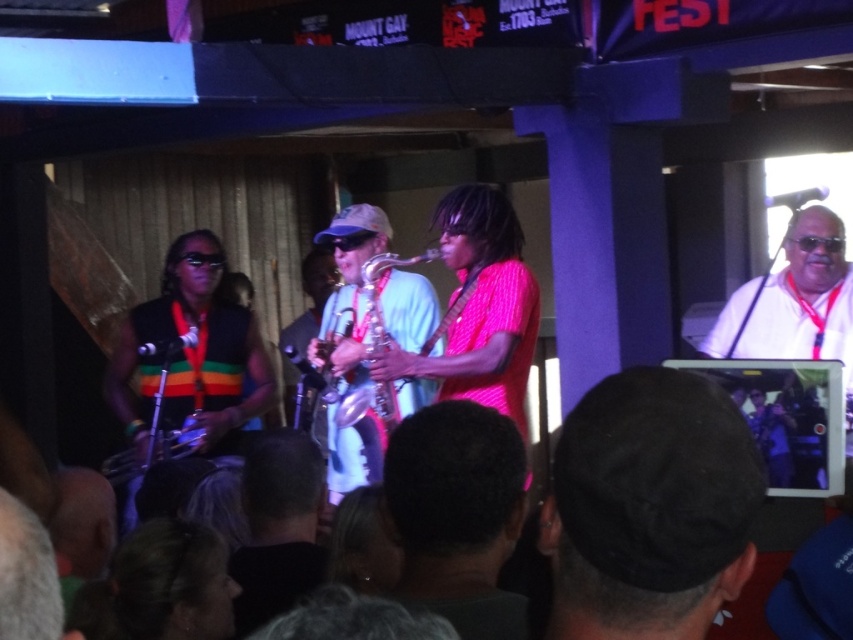
You are a photographer positioned at the front of the stage. You want to capture a closeup shot of the dark brown hair at center. According to the coordinates provided, where should you aim your camera?

The dark brown hair at center is located at coordinates point (x=457, y=515), so you should aim your camera at that specific point to capture the closeup shot.

You are a photographer at the back of the venue and want to capture a clear shot of the dark brown hair at center and the dark brown leather jacket at center. Based on their positions, which one is closer to the camera?

The dark brown hair at center is above the dark brown leather jacket at center, so the dark brown hair at center is closer to the camera.